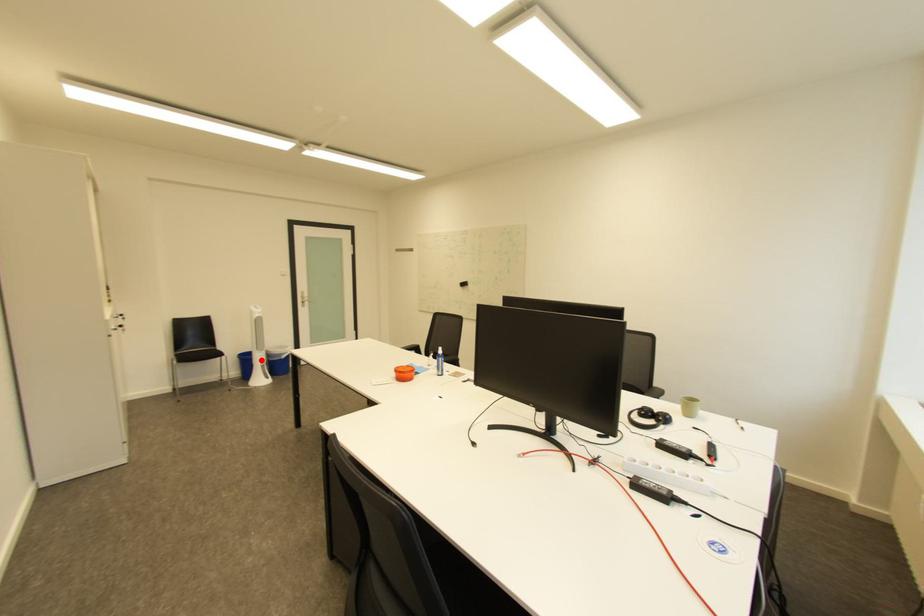
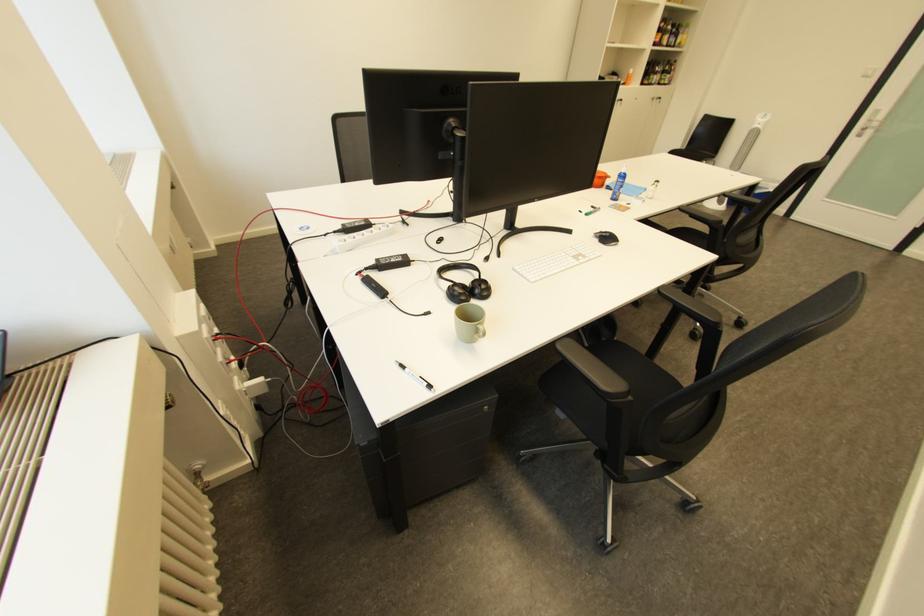
Question: I am providing you with two images of the same scene from different viewpoints. A red point is marked on the first image. Is the red point's position out of view in image 2?

Choices:
 (A) Yes
 (B) No

Answer: (A)